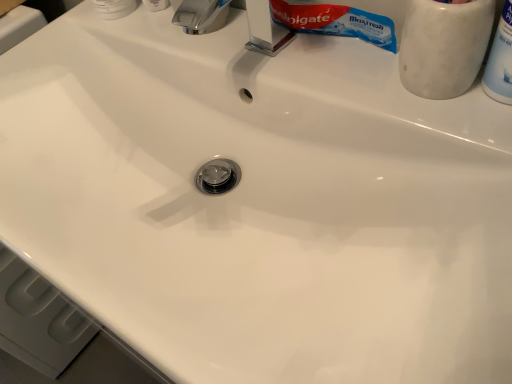
I want to click on free space to the left of white marble toothbrush holder at upper right, acting as the second toiletry starting from the left, so click(x=346, y=91).